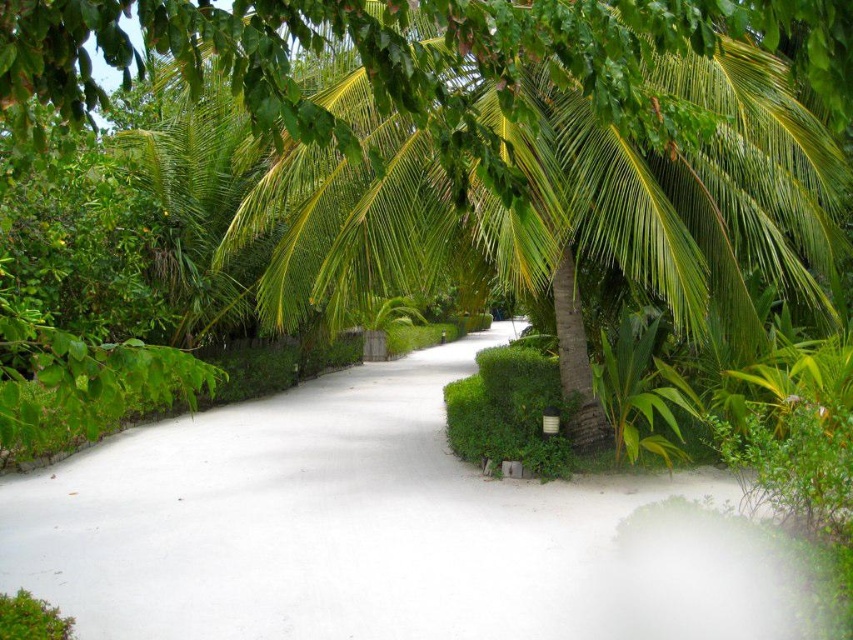
Question: Is white sand path at center bigger than green leafy coconut tree at center?

Choices:
 (A) yes
 (B) no

Answer: (A)

Question: Which object is closer to the camera taking this photo?

Choices:
 (A) green leafy coconut tree at center
 (B) white sand path at center

Answer: (A)

Question: Which point is closer to the camera?

Choices:
 (A) white sand path at center
 (B) green leafy coconut tree at center

Answer: (B)

Question: From the image, what is the correct spatial relationship of white sand path at center in relation to green leafy coconut tree at center?

Choices:
 (A) above
 (B) below

Answer: (B)

Question: Does white sand path at center come behind green leafy coconut tree at center?

Choices:
 (A) no
 (B) yes

Answer: (B)

Question: Among these points, which one is nearest to the camera?

Choices:
 (A) (235, 3)
 (B) (705, 605)

Answer: (A)